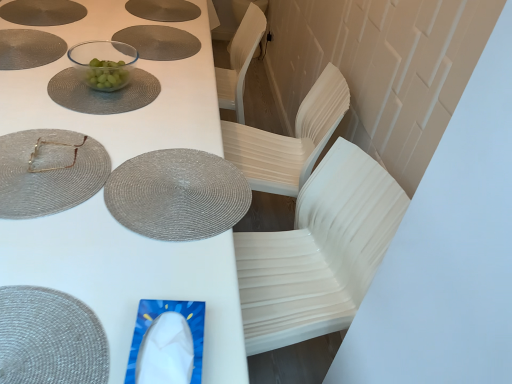
Identify the location of vacant area that is situated to the right of matte woven placemat at upper left, positioned as the second glass plate in back-to-front order. [157, 188].